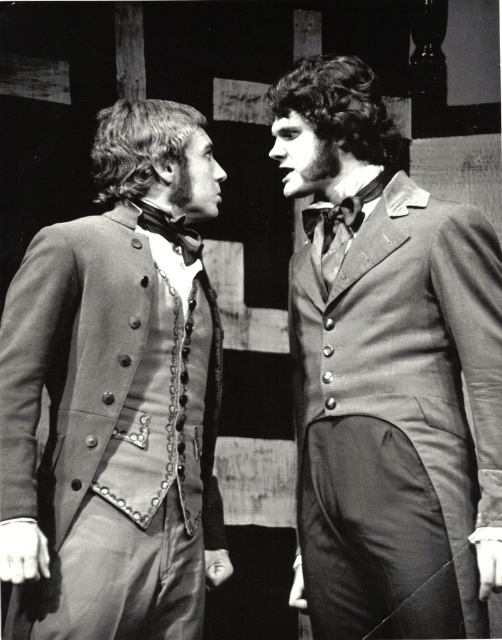
You are a costume designer analyzing the image. The scene shows two men in historical attire. There is a point marked at coordinates point (387, 372). What object is located at this point?

The point (387, 372) marks the smooth gray suit at center.

Based on the scene described, which object, the smooth gray suit at center or the smooth gray coat at left, is wider?

The smooth gray suit at center is wider than the smooth gray coat at left according to the description.

Based on the photo, you are a costume designer measuring the distance between two historical garments for a film set. You need to ensure there is enough space between the smooth gray suit at center and the smooth gray coat at left for actors to move freely. The minimum required distance is 16 inches. Based on the image, is the current spacing sufficient?

The smooth gray suit at center is 15.49 inches from the smooth gray coat at left, which is less than the required 16 inches. Therefore, the current spacing is insufficient for the actors to move freely.